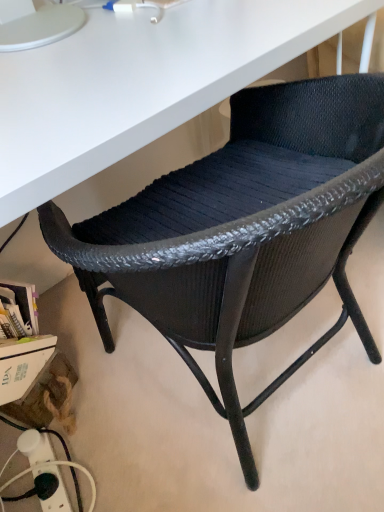
Question: Should I look upward or downward to see black plastic power strip at lower left?

Choices:
 (A) down
 (B) up

Answer: (A)

Question: Does black woven chair at center have a smaller size compared to black plastic power strip at lower left?

Choices:
 (A) no
 (B) yes

Answer: (A)

Question: From the image's perspective, is black woven chair at center beneath black plastic power strip at lower left?

Choices:
 (A) no
 (B) yes

Answer: (A)

Question: Does black woven chair at center have a lesser width compared to black plastic power strip at lower left?

Choices:
 (A) no
 (B) yes

Answer: (A)

Question: Can you confirm if black woven chair at center is wider than black plastic power strip at lower left?

Choices:
 (A) no
 (B) yes

Answer: (B)

Question: Is black woven chair at center further to camera compared to black plastic power strip at lower left?

Choices:
 (A) no
 (B) yes

Answer: (A)

Question: From a real-world perspective, is black woven chair at center over black plastic power strip at lower left?

Choices:
 (A) no
 (B) yes

Answer: (B)

Question: Is black plastic power strip at lower left wider than black woven chair at center?

Choices:
 (A) no
 (B) yes

Answer: (A)

Question: Is black plastic power strip at lower left bigger than black woven chair at center?

Choices:
 (A) yes
 (B) no

Answer: (B)

Question: Can you confirm if black plastic power strip at lower left is positioned to the left of black woven chair at center?

Choices:
 (A) no
 (B) yes

Answer: (B)

Question: Can you see black plastic power strip at lower left touching black woven chair at center?

Choices:
 (A) yes
 (B) no

Answer: (B)

Question: Is black plastic power strip at lower left facing towards black woven chair at center?

Choices:
 (A) yes
 (B) no

Answer: (A)

Question: From the image's perspective, is black plastic power strip at lower left on top of black woven chair at center?

Choices:
 (A) yes
 (B) no

Answer: (B)

Question: Considering the relative positions of black woven chair at center and black plastic power strip at lower left in the image provided, is black woven chair at center to the left or to the right of black plastic power strip at lower left?

Choices:
 (A) right
 (B) left

Answer: (A)